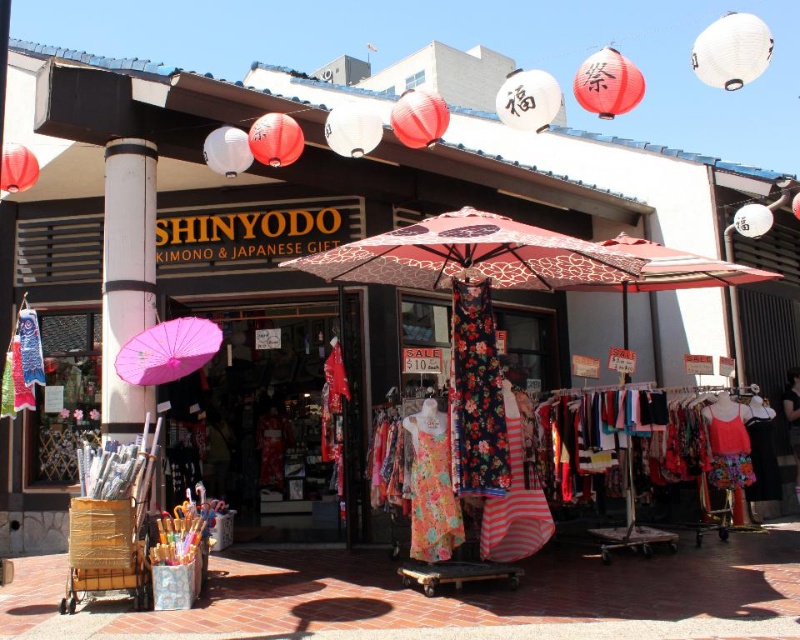
You are a customer at Shinyodo and want to buy an umbrella. The store has a red printed fabric umbrella at center and a pink paper umbrella at left. Which one is bigger?

The red printed fabric umbrella at center is larger in size than the pink paper umbrella at left.

You are a customer standing in front of the Shinyodo store. You see the wooden cart at lower left and the pink paper umbrella at left. Which object is closer to you?

The wooden cart at lower left is closer to you because it is in front of the pink paper umbrella at left.